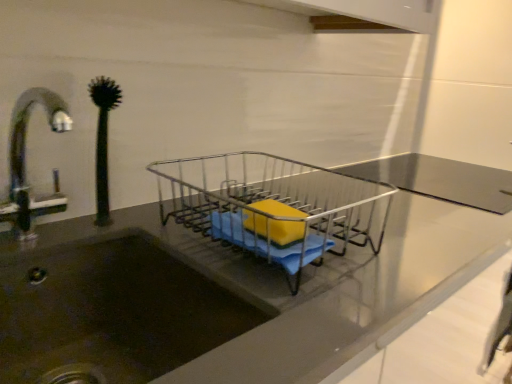
Question: Is metallic wire dish rack at center looking in the opposite direction of green rubber plant at left?

Choices:
 (A) no
 (B) yes

Answer: (A)

Question: Is metallic wire dish rack at center located outside green rubber plant at left?

Choices:
 (A) no
 (B) yes

Answer: (B)

Question: Is metallic wire dish rack at center closer to the viewer compared to green rubber plant at left?

Choices:
 (A) no
 (B) yes

Answer: (B)

Question: Can you confirm if metallic wire dish rack at center is shorter than green rubber plant at left?

Choices:
 (A) no
 (B) yes

Answer: (B)

Question: Are metallic wire dish rack at center and green rubber plant at left located far from each other?

Choices:
 (A) yes
 (B) no

Answer: (B)

Question: Considering the positions of metallic wire dish rack at center and yellow sponge at center in the image, is metallic wire dish rack at center taller or shorter than yellow sponge at center?

Choices:
 (A) short
 (B) tall

Answer: (B)

Question: Is point (218, 221) closer or farther from the camera than point (260, 218)?

Choices:
 (A) closer
 (B) farther

Answer: (B)

Question: Would you say metallic wire dish rack at center is to the left or to the right of yellow sponge at center in the picture?

Choices:
 (A) right
 (B) left

Answer: (B)

Question: From the image's perspective, is metallic wire dish rack at center above or below yellow sponge at center?

Choices:
 (A) below
 (B) above

Answer: (B)

Question: Do you think yellow sponge at center is within green rubber plant at left, or outside of it?

Choices:
 (A) inside
 (B) outside

Answer: (B)

Question: Based on their positions, is yellow sponge at center located to the left or right of green rubber plant at left?

Choices:
 (A) right
 (B) left

Answer: (A)

Question: Is yellow sponge at center taller or shorter than green rubber plant at left?

Choices:
 (A) tall
 (B) short

Answer: (B)

Question: From a real-world perspective, relative to green rubber plant at left, is yellow sponge at center vertically above or below?

Choices:
 (A) above
 (B) below

Answer: (B)

Question: In the image, is yellow sponge at center on the left side or the right side of metallic wire dish rack at center?

Choices:
 (A) right
 (B) left

Answer: (A)

Question: Is yellow sponge at center wider or thinner than metallic wire dish rack at center?

Choices:
 (A) thin
 (B) wide

Answer: (A)